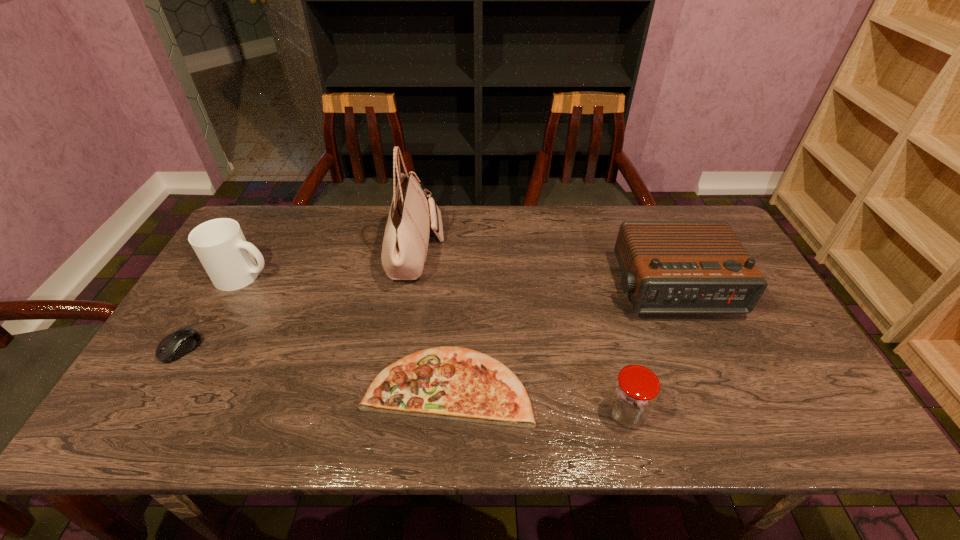
Find the location of `vacant space at the near edge of the desktop`. vacant space at the near edge of the desktop is located at coordinates (228, 423).

Where is `vacant area at the left edge`? This screenshot has height=540, width=960. vacant area at the left edge is located at coordinates (168, 381).

I want to click on free space at the right edge of the desktop, so click(x=767, y=387).

The image size is (960, 540). What are the coordinates of `free space at the far right corner of the desktop` in the screenshot? It's located at (692, 206).

Locate an element on the screen. Image resolution: width=960 pixels, height=540 pixels. vacant space in between the handbag and the jar is located at coordinates (521, 333).

Identify the location of free point between the handbag and the mug. The height and width of the screenshot is (540, 960). (330, 264).

This screenshot has width=960, height=540. In order to click on vacant area that lies between the jar and the pizza in this screenshot , I will do `click(537, 400)`.

Identify the location of free space that is in between the mouse and the pizza. This screenshot has width=960, height=540. (315, 368).

Where is `vacant point located between the radio receiver and the pizza`? This screenshot has width=960, height=540. vacant point located between the radio receiver and the pizza is located at coordinates (559, 337).

Image resolution: width=960 pixels, height=540 pixels. In order to click on empty location between the rightmost object and the mouse in this screenshot , I will do `click(425, 319)`.